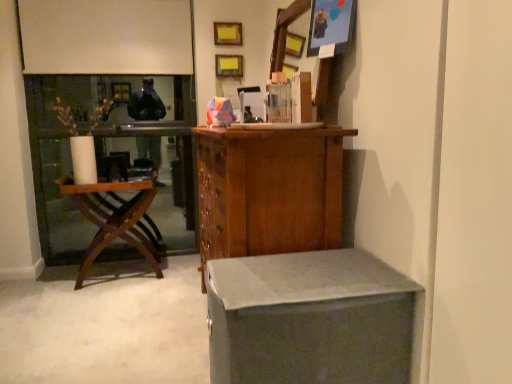
Locate an element on the screen. The width and height of the screenshot is (512, 384). wooden cabinet at center is located at coordinates (269, 190).

This screenshot has width=512, height=384. I want to click on wooden cabinet at center, so click(x=269, y=190).

Which object is closer to the camera, woodenchair at left or wooden cabinet at center?

wooden cabinet at center is in front.

Is point (90, 257) farther from viewer compared to point (301, 208)?

Yes, it is.

From the image's perspective, is woodenchair at left located beneath wooden cabinet at center?

Yes, from the image's perspective, woodenchair at left is below wooden cabinet at center.

From a real-world perspective, which object rests below the other?

From a 3D spatial view, matte gray desk at lower right is below.

Does point (264, 191) appear closer or farther from the camera than point (286, 306)?

Point (264, 191) appears to be farther away from the viewer than point (286, 306).

From the image's perspective, does wooden cabinet at center appear higher than matte gray desk at lower right?

Yes, from the image's perspective, wooden cabinet at center is over matte gray desk at lower right.

What's the angular difference between wooden cabinet at center and matte gray desk at lower right's facing directions?

The facing directions of wooden cabinet at center and matte gray desk at lower right are 0.227 degrees apart.

Is matte gray desk at lower right surrounding wooden cabinet at center?

No, wooden cabinet at center is not inside matte gray desk at lower right.

Can you confirm if matte gray desk at lower right is bigger than wooden cabinet at center?

No.

Is matte gray desk at lower right beside wooden cabinet at center?

No, matte gray desk at lower right is not making contact with wooden cabinet at center.

From a real-world perspective, which object rests below the other?

From a 3D spatial view, matte gray desk at lower right is below.

Which object is closer to the camera taking this photo, matte wooden picture frame at upper right, arranged as the 3th picture frame when viewed from the top, or woodenchair at left?

matte wooden picture frame at upper right, arranged as the 3th picture frame when viewed from the top, is more forward.

Which is less distant, (335, 16) or (151, 239)?

Point (335, 16) appears to be closer to the viewer than point (151, 239).

Is woodenchair at left at the back of matte wooden picture frame at upper right, the third picture frame when ordered from back to front?

No.

Can you confirm if matte wooden picture frame at upper right, the third picture frame when ordered from left to right, is bigger than woodenchair at left?

Actually, matte wooden picture frame at upper right, the third picture frame when ordered from left to right, might be smaller than woodenchair at left.

Can you see matte yellow picture frame at upper center, which ranks as the 3th picture frame in bottom-to-top order, touching wooden picture frame at upper center, the 2th picture frame when ordered from right to left?

No, matte yellow picture frame at upper center, which ranks as the 3th picture frame in bottom-to-top order, is not with wooden picture frame at upper center, the 2th picture frame when ordered from right to left.

Which object is wider, matte yellow picture frame at upper center, which ranks as the 3th picture frame in bottom-to-top order, or wooden picture frame at upper center, positioned as the second picture frame in bottom-to-top order?

wooden picture frame at upper center, positioned as the second picture frame in bottom-to-top order.

From a real-world perspective, does matte yellow picture frame at upper center, the first picture frame viewed from the left, sit lower than wooden picture frame at upper center, the 1th picture frame from the back?

Incorrect, from a real-world perspective, matte yellow picture frame at upper center, the first picture frame viewed from the left, is higher than wooden picture frame at upper center, the 1th picture frame from the back.

Could you tell me if wooden picture frame at upper center, acting as the 2th picture frame starting from the top, is turned towards matte yellow picture frame at upper center, which ranks as the 3th picture frame in bottom-to-top order?

No, wooden picture frame at upper center, acting as the 2th picture frame starting from the top, is not facing towards matte yellow picture frame at upper center, which ranks as the 3th picture frame in bottom-to-top order.

Is point (240, 67) less distant than point (236, 24)?

No, it is behind (236, 24).

Is wooden picture frame at upper center, the 2th picture frame when ordered from left to right, directly adjacent to matte yellow picture frame at upper center, the third picture frame in the right-to-left sequence?

They are not placed beside each other.

This screenshot has height=384, width=512. There is a wooden picture frame at upper center, the 2th picture frame when ordered from left to right. Identify the location of picture frame above it (from a real-world perspective). (228, 33).

Is wooden picture frame at upper center, the 2th picture frame when ordered from left to right, inside or outside of matte wooden picture frame at upper right, the third picture frame when ordered from left to right?

The correct answer is: outside.

Who is shorter, wooden picture frame at upper center, acting as the 2th picture frame starting from the top, or matte wooden picture frame at upper right, the third picture frame when ordered from left to right?

With less height is wooden picture frame at upper center, acting as the 2th picture frame starting from the top.

What's the angular difference between wooden picture frame at upper center, acting as the 2th picture frame starting from the top, and matte wooden picture frame at upper right, arranged as the 3th picture frame when viewed from the top,'s facing directions?

The angular difference between wooden picture frame at upper center, acting as the 2th picture frame starting from the top, and matte wooden picture frame at upper right, arranged as the 3th picture frame when viewed from the top, is 90 degrees.

At what (x,y) coordinates should I click in order to perform the action: click on chair below the wooden cabinet at center (from the image's perspective). Please return your answer as a coordinate pair (x, y). Looking at the image, I should click on (115, 219).

Locate an element on the screen. The image size is (512, 384). desk that appears on the right of wooden cabinet at center is located at coordinates (309, 319).

Estimate the real-world distances between objects in this image. Which object is closer to wooden picture frame at upper center, positioned as the second picture frame in bottom-to-top order, wooden cabinet at center or matte gray desk at lower right?

wooden cabinet at center.

From the image, which object appears to be farther from matte wooden picture frame at upper right, the third picture frame when ordered from left to right, matte yellow picture frame at upper center, the third picture frame in the right-to-left sequence, or woodenchair at left?

The object further to matte wooden picture frame at upper right, the third picture frame when ordered from left to right, is woodenchair at left.

Which object lies nearer to the anchor point wooden cabinet at center, wooden picture frame at upper center, acting as the 2th picture frame starting from the top, or matte yellow picture frame at upper center, arranged as the 2th picture frame when viewed from the back?

Based on the image, wooden picture frame at upper center, acting as the 2th picture frame starting from the top, appears to be nearer to wooden cabinet at center.

From the image, which object appears to be farther from wooden cabinet at center, matte wooden picture frame at upper right, which is the 1th picture frame from front to back, or wooden picture frame at upper center, positioned as the second picture frame in bottom-to-top order?

wooden picture frame at upper center, positioned as the second picture frame in bottom-to-top order, is further to wooden cabinet at center.

When comparing their distances from wooden cabinet at center, does woodenchair at left or matte yellow picture frame at upper center, which ranks as the 3th picture frame in bottom-to-top order, seem further?

The object further to wooden cabinet at center is matte yellow picture frame at upper center, which ranks as the 3th picture frame in bottom-to-top order.

From the image, which object appears to be farther from matte yellow picture frame at upper center, the third picture frame in the right-to-left sequence, woodenchair at left or wooden cabinet at center?

The object further to matte yellow picture frame at upper center, the third picture frame in the right-to-left sequence, is wooden cabinet at center.

Based on their spatial positions, is matte gray desk at lower right or matte yellow picture frame at upper center, which appears as the first picture frame when viewed from the top, closer to wooden picture frame at upper center, positioned as the second picture frame in bottom-to-top order?

matte yellow picture frame at upper center, which appears as the first picture frame when viewed from the top, is closer to wooden picture frame at upper center, positioned as the second picture frame in bottom-to-top order.

Looking at the image, which one is located further to wooden picture frame at upper center, positioned as the second picture frame in bottom-to-top order, matte yellow picture frame at upper center, arranged as the 2th picture frame when viewed from the back, or wooden cabinet at center?

Among the two, wooden cabinet at center is located further to wooden picture frame at upper center, positioned as the second picture frame in bottom-to-top order.

Find the location of a particular element. The width and height of the screenshot is (512, 384). picture frame located between matte wooden picture frame at upper right, the third picture frame when ordered from left to right, and wooden picture frame at upper center, the 2th picture frame when ordered from left to right, in the depth direction is located at coordinates (228, 33).

Find the location of a particular element. This screenshot has width=512, height=384. chair between matte gray desk at lower right and wooden picture frame at upper center, which is the 3th picture frame in front-to-back order, along the z-axis is located at coordinates (115, 219).

Where is `picture frame between wooden cabinet at center and matte yellow picture frame at upper center, the third picture frame in the right-to-left sequence, from front to back`? This screenshot has width=512, height=384. picture frame between wooden cabinet at center and matte yellow picture frame at upper center, the third picture frame in the right-to-left sequence, from front to back is located at coordinates (331, 25).

Locate an element on the screen. chair located between wooden cabinet at center and wooden picture frame at upper center, the 2th picture frame when ordered from left to right, in the depth direction is located at coordinates (115, 219).